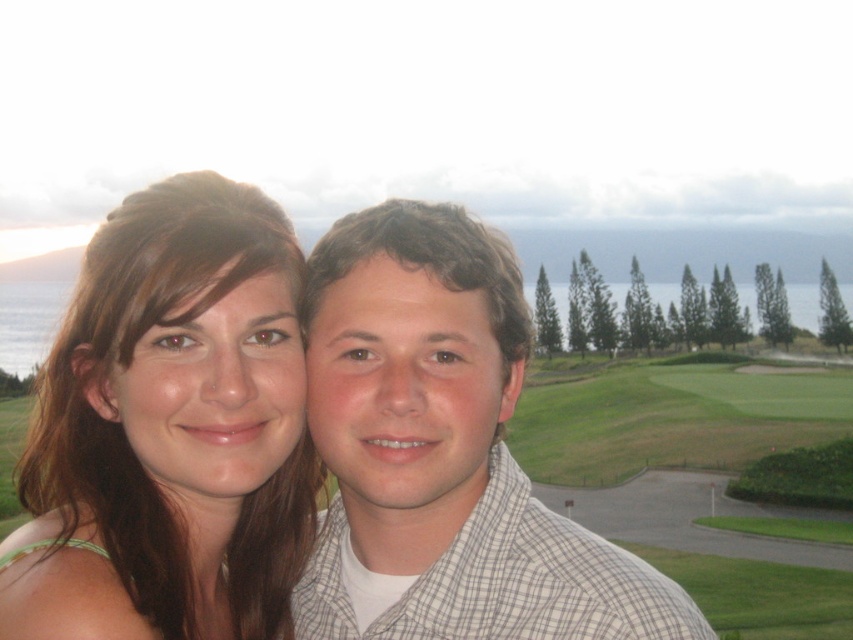
Question: Which point is closer to the camera?

Choices:
 (A) matte white shirt at center
 (B) matte brown hair at center

Answer: (B)

Question: Does matte brown hair at center appear on the left side of matte white shirt at center?

Choices:
 (A) yes
 (B) no

Answer: (A)

Question: Can you confirm if matte brown hair at center is positioned to the left of matte white shirt at center?

Choices:
 (A) no
 (B) yes

Answer: (B)

Question: Among these objects, which one is nearest to the camera?

Choices:
 (A) matte white shirt at center
 (B) matte brown hair at center

Answer: (B)

Question: Does matte brown hair at center have a lesser width compared to matte white shirt at center?

Choices:
 (A) yes
 (B) no

Answer: (A)